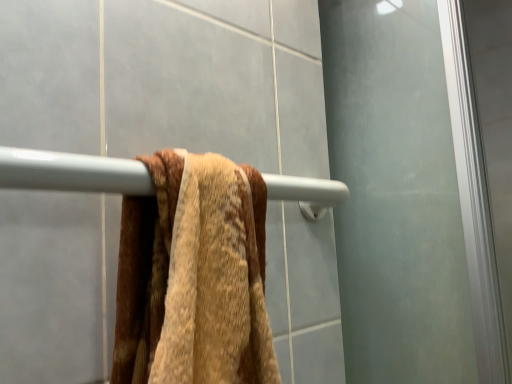
What do you see at coordinates (72, 172) in the screenshot? Image resolution: width=512 pixels, height=384 pixels. I see `white matte towel bar at center` at bounding box center [72, 172].

What is the approximate height of white matte towel bar at center?

2.58 inches.

Consider the image. Measure the distance between point (142, 193) and camera.

Point (142, 193) and camera are 34.60 centimeters apart.

Identify the location of white matte towel bar at center. This screenshot has height=384, width=512. (72, 172).

The width and height of the screenshot is (512, 384). Identify the location of white matte towel bar at center. [72, 172].